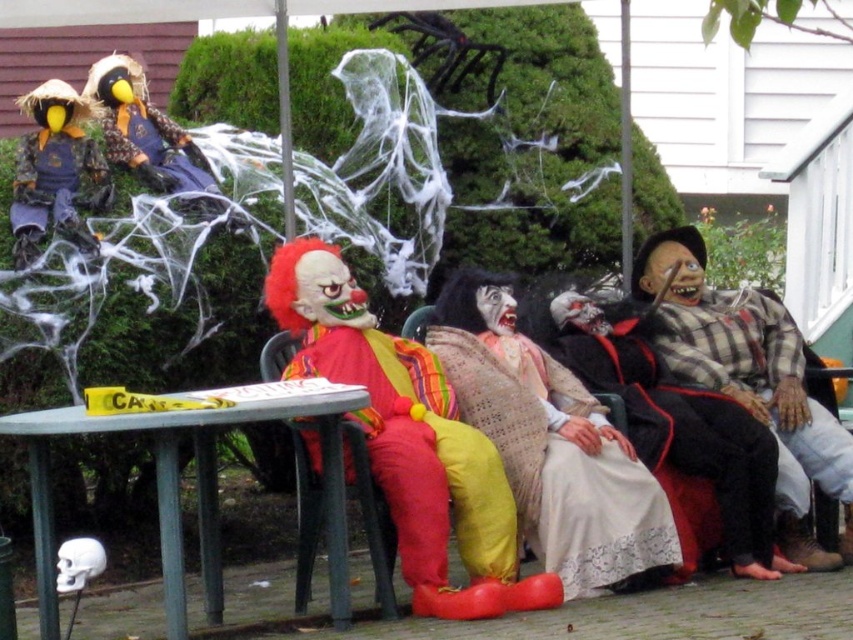
Does metallic gray table at center have a greater width compared to matte yellow and brown costume at upper left?

Yes, metallic gray table at center is wider than matte yellow and brown costume at upper left.

Locate an element on the screen. The height and width of the screenshot is (640, 853). metallic gray table at center is located at coordinates (196, 484).

The height and width of the screenshot is (640, 853). In order to click on metallic gray table at center in this screenshot , I will do `click(196, 484)`.

Image resolution: width=853 pixels, height=640 pixels. What do you see at coordinates (409, 440) in the screenshot? I see `matte clown costume at center` at bounding box center [409, 440].

Between matte clown costume at center and matte yellow scarecrow at upper left, which one has more height?

With more height is matte clown costume at center.

From the picture: Who is more forward, (486, 605) or (64, 147)?

Point (486, 605)

Where is `matte clown costume at center`? Image resolution: width=853 pixels, height=640 pixels. matte clown costume at center is located at coordinates (409, 440).

This screenshot has width=853, height=640. What do you see at coordinates (560, 465) in the screenshot?
I see `white lace dress at center` at bounding box center [560, 465].

Does white lace dress at center appear under matte yellow scarecrow at upper left?

Yes, white lace dress at center is below matte yellow scarecrow at upper left.

Who is more forward, (x=556, y=566) or (x=45, y=220)?

Point (x=556, y=566) is in front.

The height and width of the screenshot is (640, 853). Find the location of `white lace dress at center`. white lace dress at center is located at coordinates (560, 465).